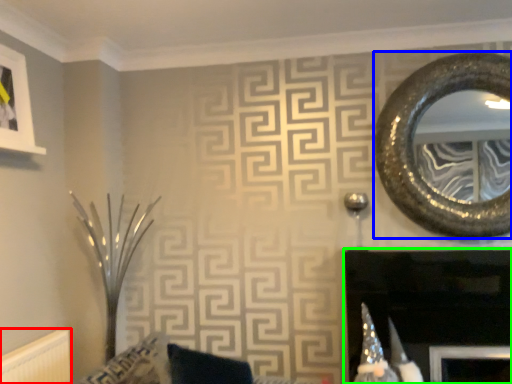
Question: Considering the real-world distances, which object is closest to radiator (highlighted by a red box)? oval (highlighted by a blue box) or fireplace (highlighted by a green box).

Choices:
 (A) oval
 (B) fireplace

Answer: (B)